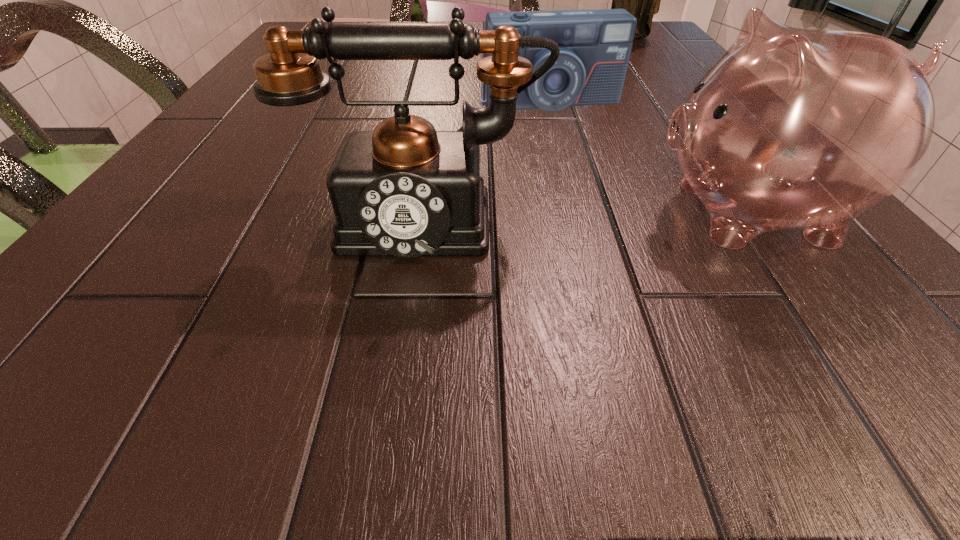
In order to click on vacant space on the desktop that is between the telephone and the piggy bank and is positioned on the lens of the second farthest object in this screenshot , I will do `click(604, 213)`.

Locate an element on the screen. This screenshot has height=540, width=960. free space on the desktop that is between the telephone and the piggy bank and is positioned on the front-facing side of the farthest object is located at coordinates (552, 213).